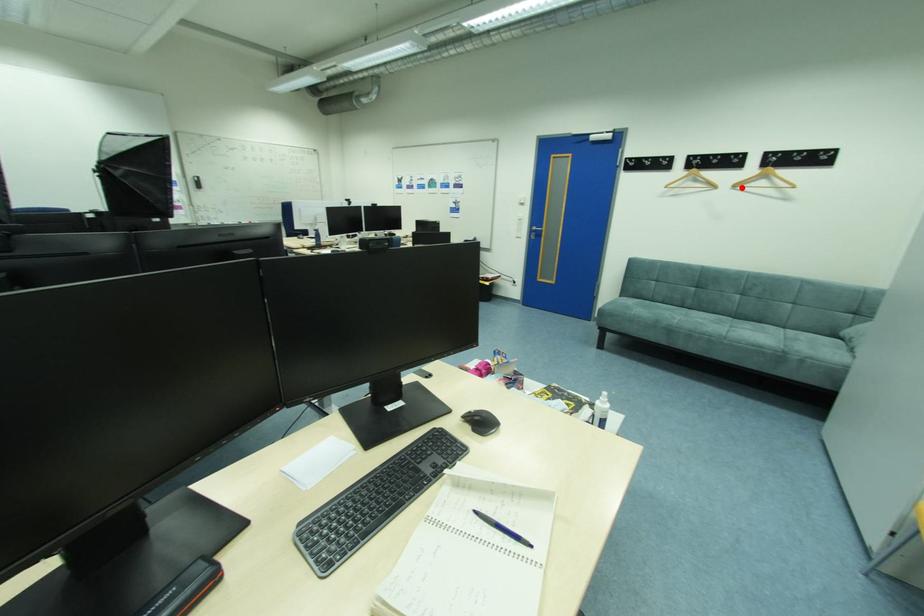
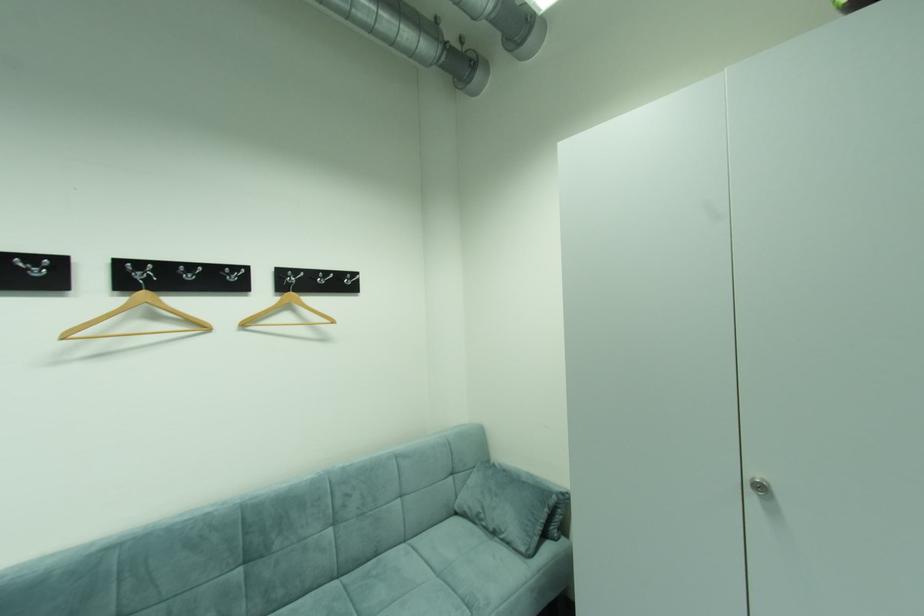
In the second image, find the point that corresponds to the highlighted location in the first image.

(251, 326)